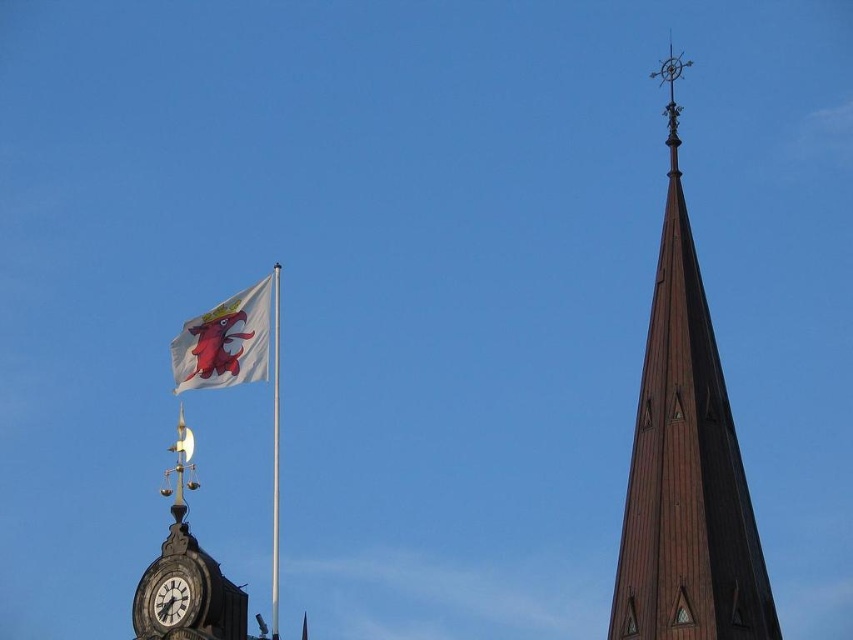
Question: Which object appears closest to the camera in this image?

Choices:
 (A) white fabric flag at upper left
 (B) white clock face at lower left
 (C) matte black clock at lower left

Answer: (C)

Question: Among these points, which one is nearest to the camera?

Choices:
 (A) (276, 541)
 (B) (225, 349)

Answer: (B)

Question: Is white fabric flag at upper left below white fabric flagpole at upper left?

Choices:
 (A) no
 (B) yes

Answer: (A)

Question: Estimate the real-world distances between objects in this image. Which object is closer to the white clock face at lower left?

Choices:
 (A) white fabric flag at upper left
 (B) matte black clock at lower left

Answer: (B)

Question: Does brown wooden spire at upper right appear under matte black clock at lower left?

Choices:
 (A) yes
 (B) no

Answer: (B)

Question: Is white fabric flag at upper left thinner than white fabric flagpole at upper left?

Choices:
 (A) no
 (B) yes

Answer: (A)